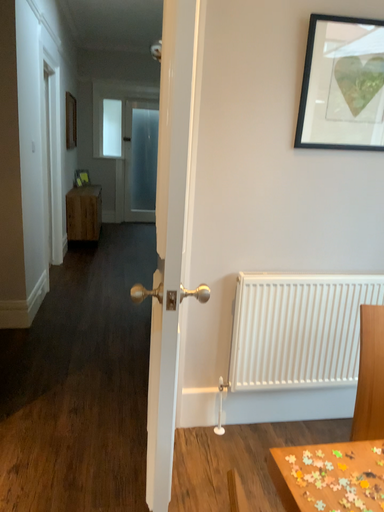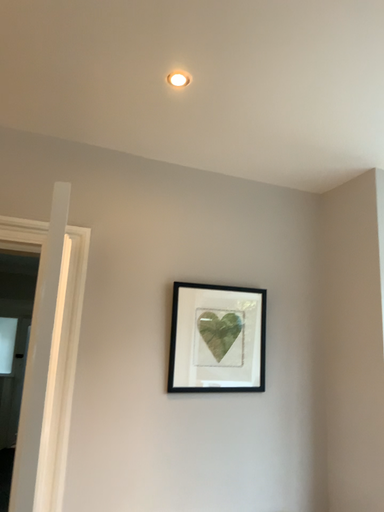
Question: Which way did the camera rotate in the video?

Choices:
 (A) rotated downward
 (B) rotated upward

Answer: (B)